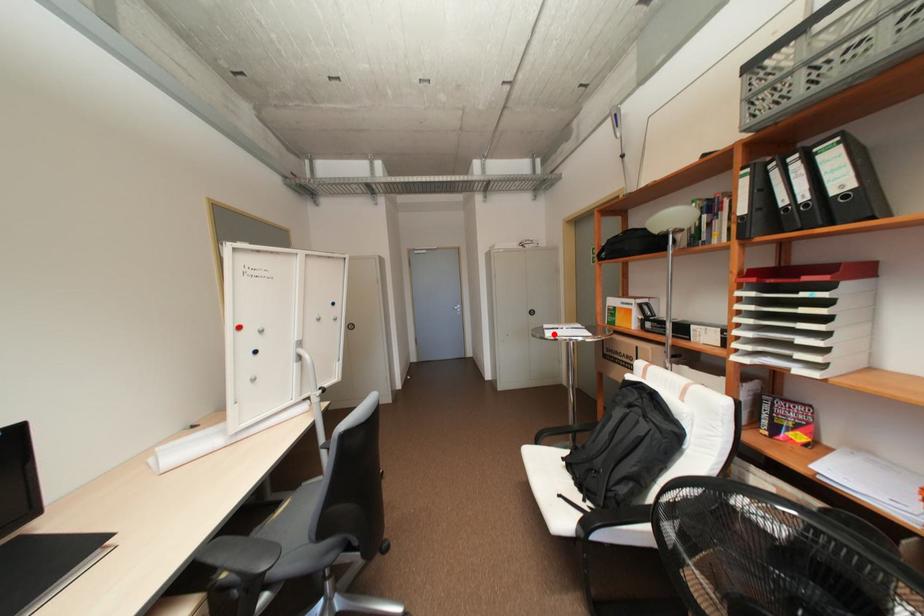
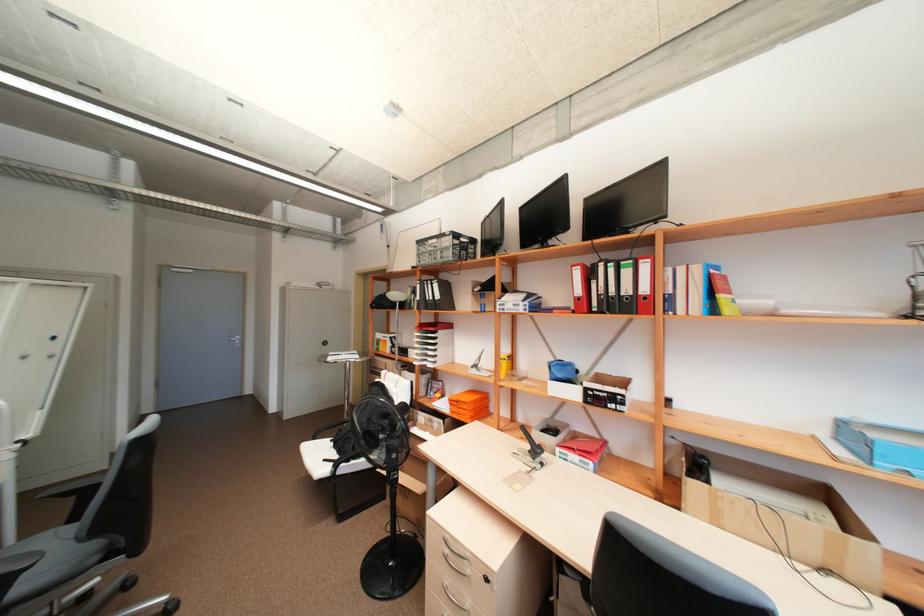
The point at the highlighted location is marked in the first image. Where is the corresponding point in the second image?

(334, 359)